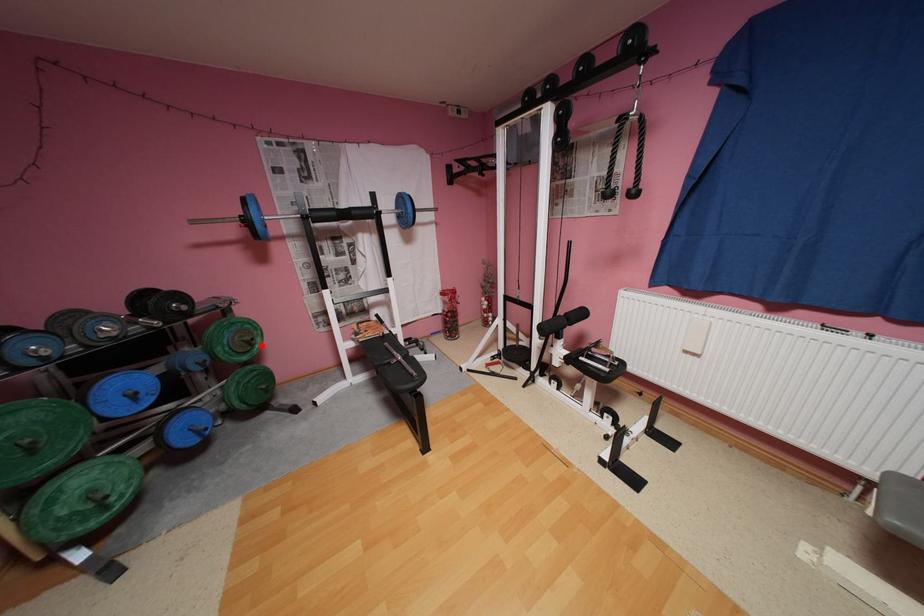
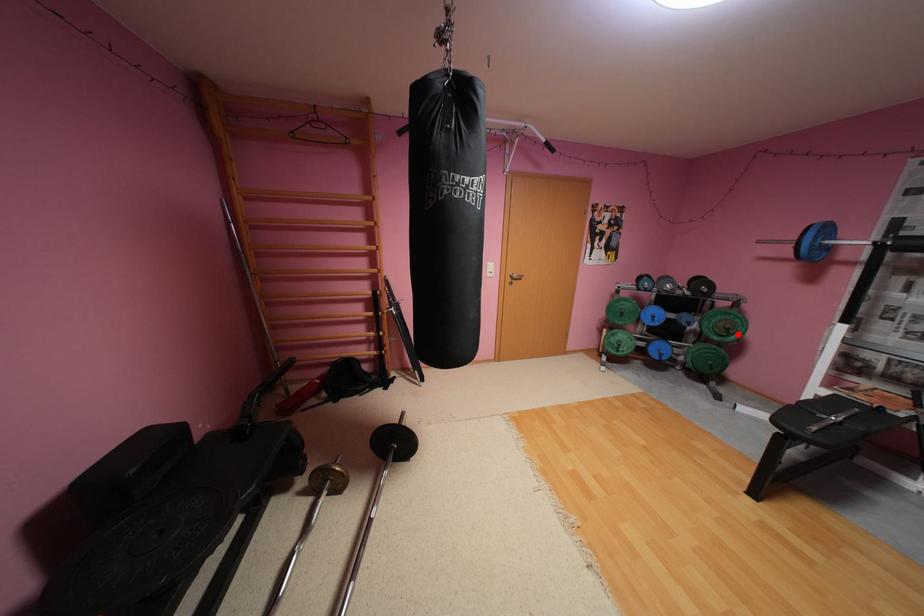
I am providing you with two images of the same scene from different viewpoints. A red point is marked on the first image and another point is marked on the second image. Does the point marked in image1 correspond to the same location as the one in image2?

Yes